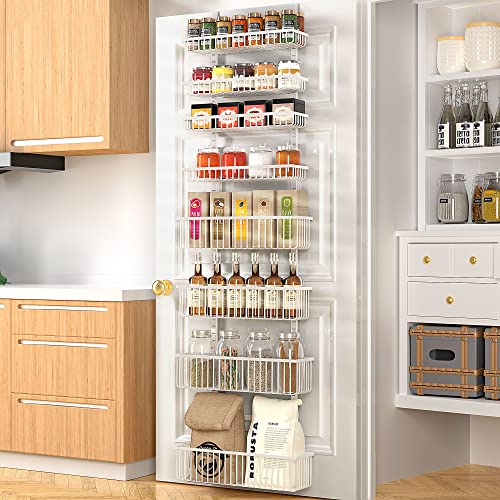
Identify the location of lids on glass jars on top shelf. (195, 20), (204, 18), (222, 16), (239, 14), (251, 13), (269, 10), (287, 12).